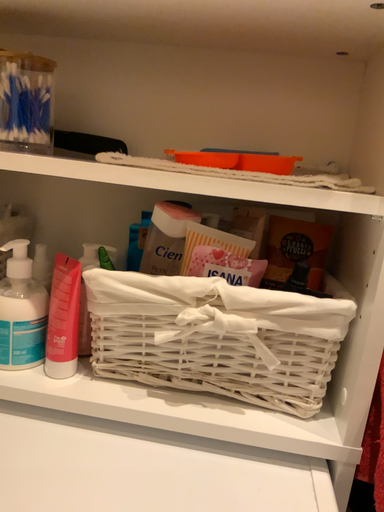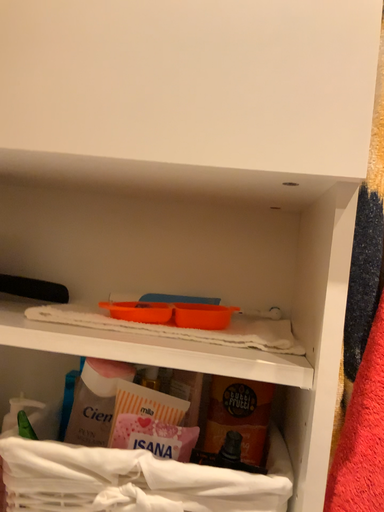
Question: Which way did the camera rotate in the video?

Choices:
 (A) rotated downward
 (B) rotated upward

Answer: (B)